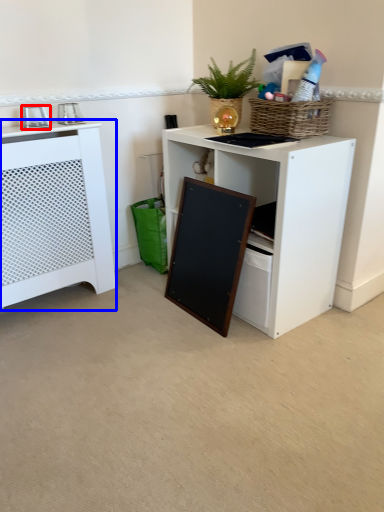
Question: Which object is further to the camera taking this photo, appliance (highlighted by a red box) or cabinetry (highlighted by a blue box)?

Choices:
 (A) appliance
 (B) cabinetry

Answer: (A)